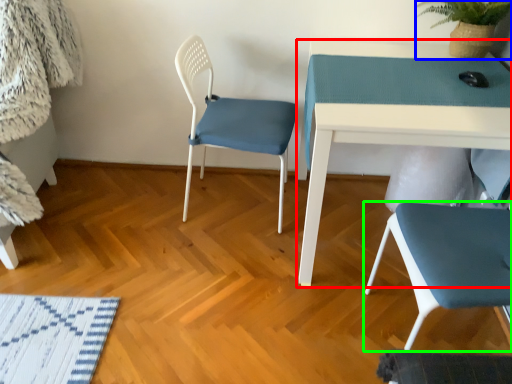
Question: Based on their relative distances, which object is nearer to table (highlighted by a red box)? Choose from plant (highlighted by a blue box) and chair (highlighted by a green box).

Choices:
 (A) plant
 (B) chair

Answer: (B)